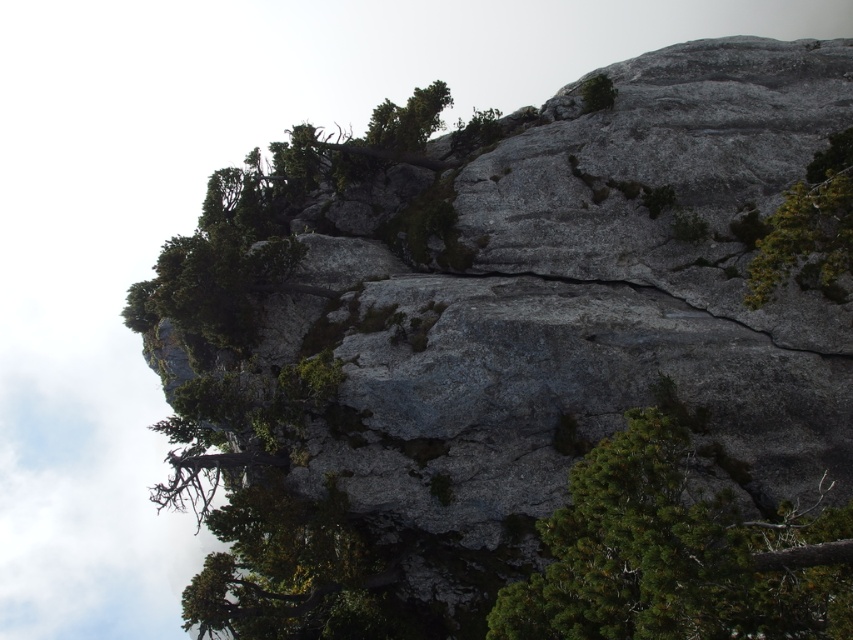
You are a hiker standing at the base of the cliff. You see a green leafy tree marked by point (808,225). Which direction should you look to find the tree?

The green leafy tree at upper right is located at the upper right direction from your position at the base of the cliff.

You are a hiker standing at the base of the cliff and want to reach the highest point on the cliff face. Which point, point (x=490, y=624) or point (x=785, y=212), is closer to you and might be a better starting point for your climb?

Point (x=490, y=624) is closer to the viewer than point (x=785, y=212), so it might be a better starting point for your climb since it is nearer to your current position.